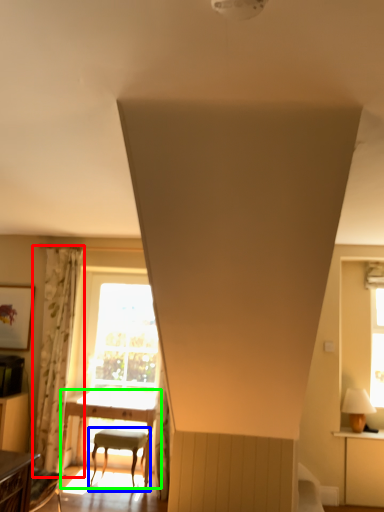
Question: Which object is positioned farthest from curtain (highlighted by a red box)? Select from chair (highlighted by a blue box) and table (highlighted by a green box).

Choices:
 (A) chair
 (B) table

Answer: (A)